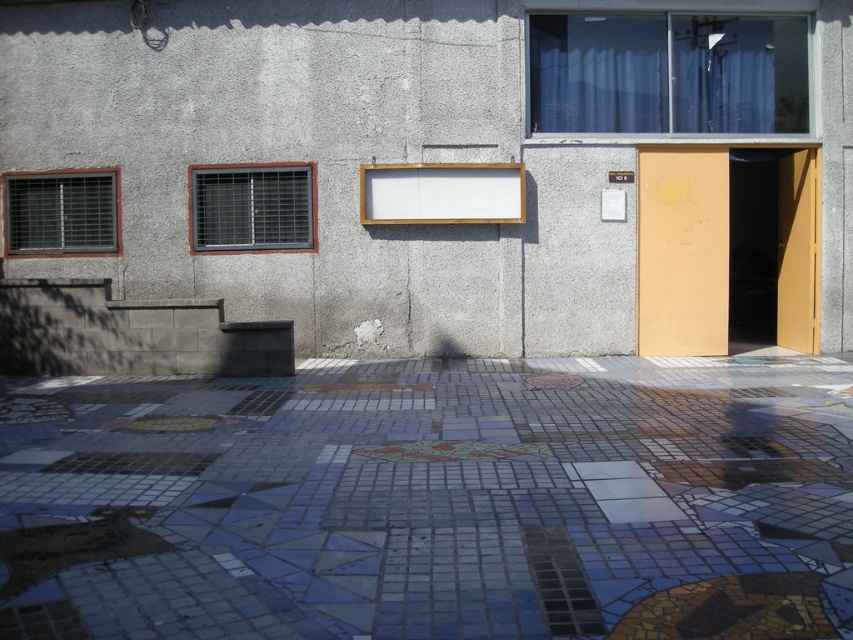
Question: Does mosaic tile pavement at center have a smaller size compared to matte yellow door at right?

Choices:
 (A) no
 (B) yes

Answer: (B)

Question: Which of the following is the farthest from the observer?

Choices:
 (A) matte yellow door at right
 (B) mosaic tile pavement at center

Answer: (A)

Question: Among these objects, which one is farthest from the camera?

Choices:
 (A) matte yellow door at right
 (B) mosaic tile pavement at center

Answer: (A)

Question: Is mosaic tile pavement at center smaller than matte yellow door at right?

Choices:
 (A) yes
 (B) no

Answer: (A)

Question: Observing the image, what is the correct spatial positioning of mosaic tile pavement at center in reference to matte yellow door at right?

Choices:
 (A) left
 (B) right

Answer: (A)